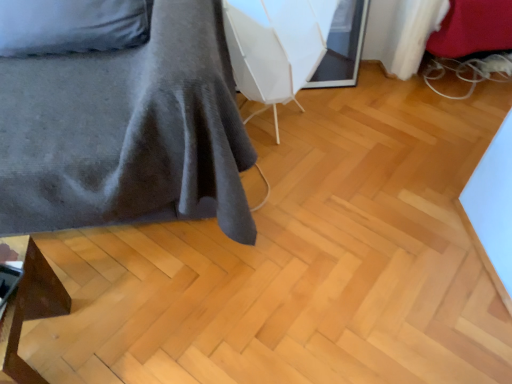
Identify the location of vacant area located to the right-hand side of velvet grey bedspread at left, positioned as the second furniture in bottom-to-top order. [356, 215].